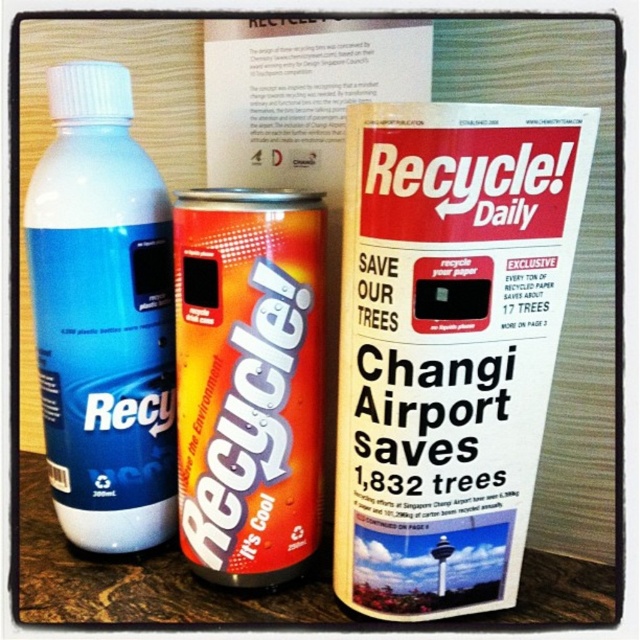
Question: Is recycled paper magazine at center bigger than orange metallic can at center?

Choices:
 (A) yes
 (B) no

Answer: (A)

Question: Among these objects, which one is farthest from the camera?

Choices:
 (A) orange metallic can at center
 (B) recycled paper magazine at center

Answer: (A)

Question: From the image, what is the correct spatial relationship of blue matte bottle at left in relation to orange metallic can at center?

Choices:
 (A) left
 (B) right

Answer: (A)

Question: Which object is closer to the camera taking this photo?

Choices:
 (A) blue matte bottle at left
 (B) recycled paper magazine at center

Answer: (B)

Question: Does recycled paper magazine at center appear under blue matte bottle at left?

Choices:
 (A) no
 (B) yes

Answer: (B)

Question: Which point appears farthest from the camera in this image?

Choices:
 (A) coord(260,243)
 (B) coord(496,314)
 (C) coord(100,522)

Answer: (C)